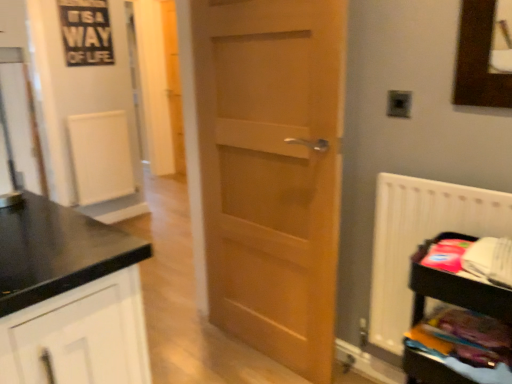
Question: Can you confirm if white plastic radiator at right is wider than transparent glass door at left?

Choices:
 (A) no
 (B) yes

Answer: (A)

Question: Is white plastic radiator at right in front of transparent glass door at left?

Choices:
 (A) yes
 (B) no

Answer: (B)

Question: Can you confirm if white plastic radiator at right is bigger than transparent glass door at left?

Choices:
 (A) no
 (B) yes

Answer: (B)

Question: Does white plastic radiator at right appear on the left side of transparent glass door at left?

Choices:
 (A) no
 (B) yes

Answer: (A)

Question: From a real-world perspective, does white plastic radiator at right sit lower than transparent glass door at left?

Choices:
 (A) yes
 (B) no

Answer: (A)

Question: From the image's perspective, is light brown wood door at center positioned above or below white plastic radiator at right?

Choices:
 (A) above
 (B) below

Answer: (A)

Question: In the image, is light brown wood door at center positioned in front of or behind white plastic radiator at right?

Choices:
 (A) behind
 (B) front

Answer: (A)

Question: From their relative heights in the image, would you say light brown wood door at center is taller or shorter than white plastic radiator at right?

Choices:
 (A) tall
 (B) short

Answer: (A)

Question: Is light brown wood door at center wider or thinner than white plastic radiator at right?

Choices:
 (A) wide
 (B) thin

Answer: (B)

Question: From the image's perspective, is transparent glass door at left above or below wooden shelf at lower right?

Choices:
 (A) below
 (B) above

Answer: (B)

Question: Is transparent glass door at left bigger or smaller than wooden shelf at lower right?

Choices:
 (A) big
 (B) small

Answer: (B)

Question: In terms of height, does transparent glass door at left look taller or shorter compared to wooden shelf at lower right?

Choices:
 (A) tall
 (B) short

Answer: (B)

Question: In the image, is transparent glass door at left on the left side or the right side of wooden shelf at lower right?

Choices:
 (A) left
 (B) right

Answer: (A)

Question: Visually, is white plastic radiator at right positioned to the left or to the right of wooden shelf at lower right?

Choices:
 (A) right
 (B) left

Answer: (B)

Question: Is white plastic radiator at right in front of or behind wooden shelf at lower right in the image?

Choices:
 (A) front
 (B) behind

Answer: (B)